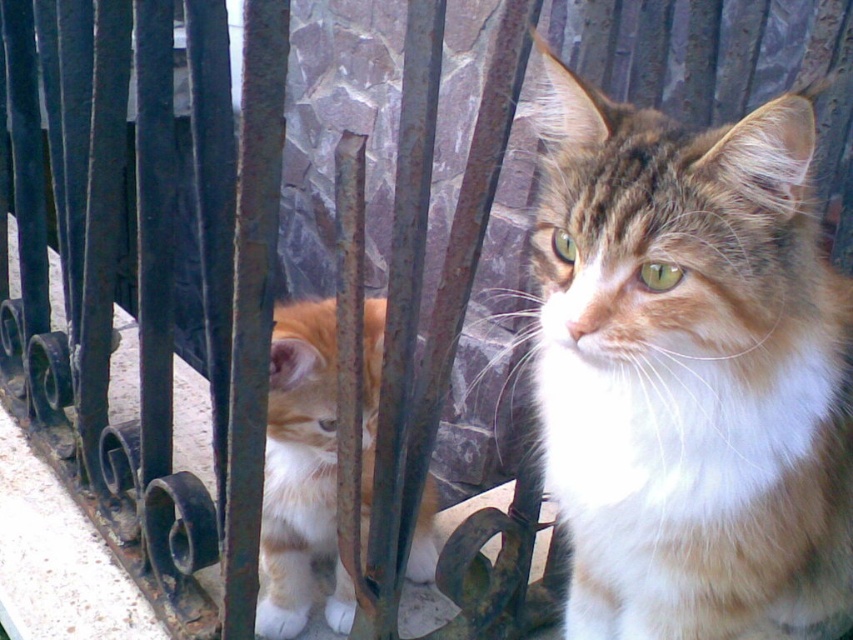
You are standing in front of the metal fence with two cats behind it. You notice two points marked on the image at coordinates point (735,323) and point (308,532). Which of these points is closer to your viewpoint?

Point (735,323) is closer to the camera than point (308,532).